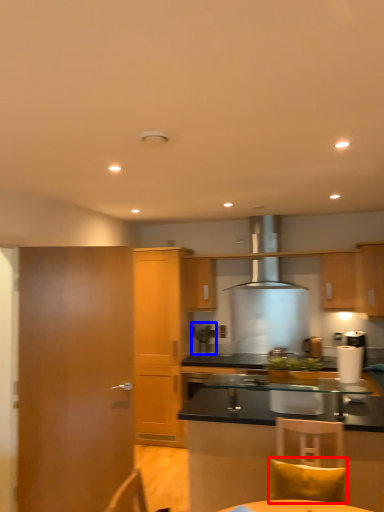
Question: Which object appears closest to the camera in this image, pillow (highlighted by a red box) or coffee machine (highlighted by a blue box)?

Choices:
 (A) pillow
 (B) coffee machine

Answer: (A)